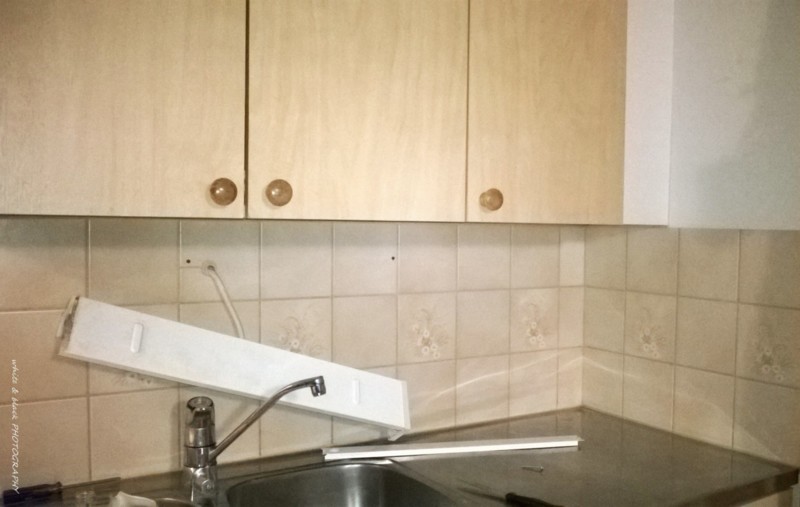
Identify the location of cabinet. The image size is (800, 507). pyautogui.click(x=162, y=82), pyautogui.click(x=340, y=107), pyautogui.click(x=590, y=105).